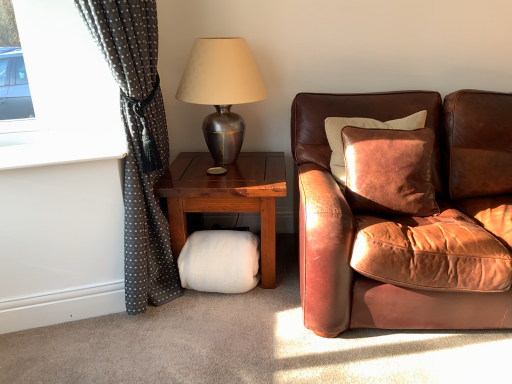
The height and width of the screenshot is (384, 512). Identify the location of vacant space to the right of white fluffy footrest at lower center. (278, 296).